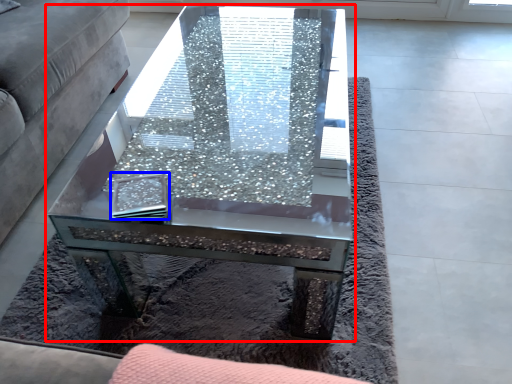
Question: Among these objects, which one is nearest to the camera, coffee table (highlighted by a red box) or pad (highlighted by a blue box)?

Choices:
 (A) coffee table
 (B) pad

Answer: (A)